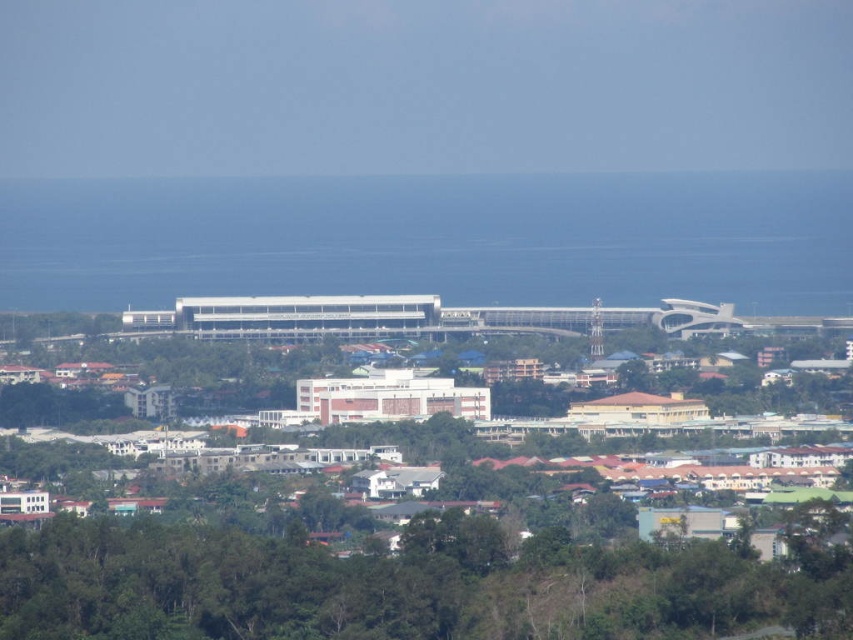
Question: Among these objects, which one is nearest to the camera?

Choices:
 (A) transparent glass water at center
 (B) green leafy trees at lower center

Answer: (A)

Question: Is transparent glass water at center to the right of green leafy trees at lower center from the viewer's perspective?

Choices:
 (A) no
 (B) yes

Answer: (B)

Question: Is transparent glass water at center to the left of green leafy trees at lower center from the viewer's perspective?

Choices:
 (A) no
 (B) yes

Answer: (A)

Question: Is the position of transparent glass water at center more distant than that of green leafy trees at lower center?

Choices:
 (A) yes
 (B) no

Answer: (B)

Question: Which of the following is the closest to the observer?

Choices:
 (A) (x=183, y=259)
 (B) (x=120, y=636)

Answer: (A)